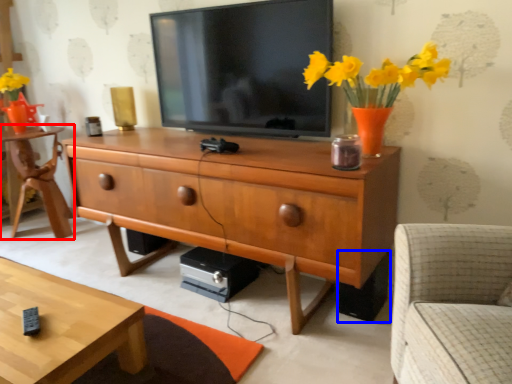
Question: Among these objects, which one is nearest to the camera, desk (highlighted by a red box) or speaker (highlighted by a blue box)?

Choices:
 (A) desk
 (B) speaker

Answer: (B)